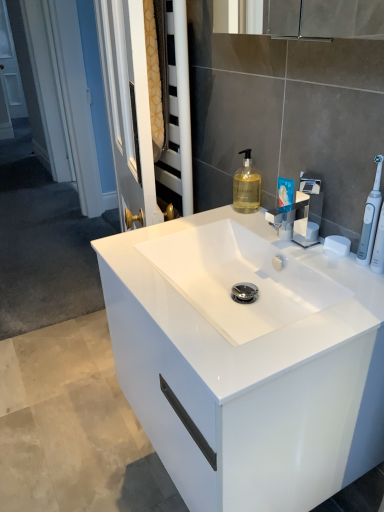
In order to click on free space to the left of translucent yellow liquid at center in this screenshot , I will do `click(203, 218)`.